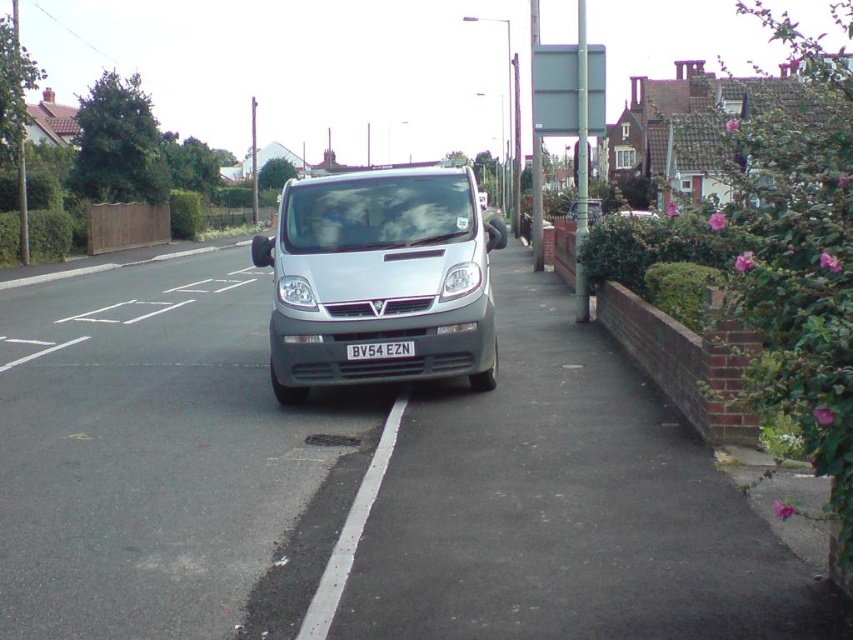
Question: Is silver metallic van at center positioned at the back of white plastic license plate at center?

Choices:
 (A) no
 (B) yes

Answer: (B)

Question: Which object appears closest to the camera in this image?

Choices:
 (A) white plastic license plate at center
 (B) silver metallic van at center

Answer: (A)

Question: Does silver metallic van at center have a smaller size compared to white plastic license plate at center?

Choices:
 (A) yes
 (B) no

Answer: (B)

Question: Does silver metallic van at center appear under white plastic license plate at center?

Choices:
 (A) no
 (B) yes

Answer: (A)